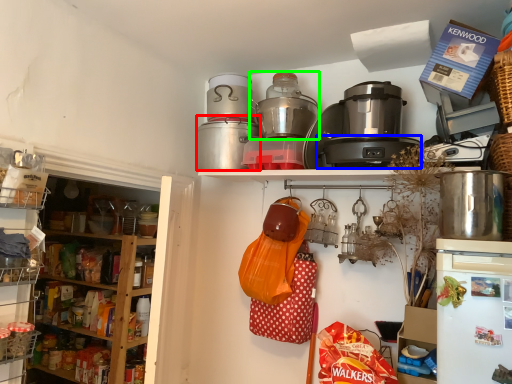
Question: Which object is positioned farthest from crock pot (highlighted by a red box)? Select from appliance (highlighted by a blue box) and rice cooker (highlighted by a green box).

Choices:
 (A) appliance
 (B) rice cooker

Answer: (A)